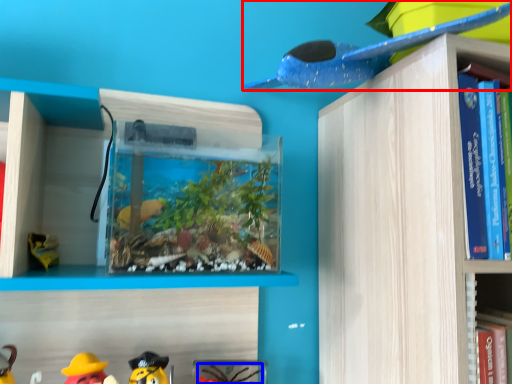
Question: Which object appears closest to the camera in this image, toy (highlighted by a red box) or toy (highlighted by a blue box)?

Choices:
 (A) toy
 (B) toy

Answer: (A)